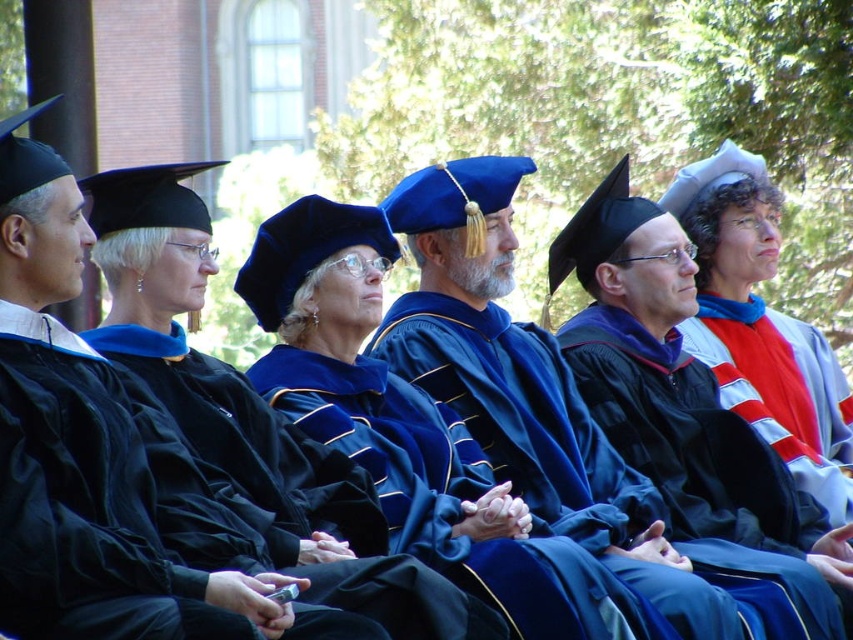
You are a photographer trying to capture a clear shot of the velvet blue graduation gown at center and the velvet blue gown at center. Which one is positioned higher in the image?

The velvet blue graduation gown at center is positioned higher than the velvet blue gown at center in the image.

You are a photographer at the graduation ceremony. You need to capture a photo of the matte black graduation gown at center and the velvet blue gown at center. From the perspective of someone looking at the image, which gown is positioned higher in the frame?

The matte black graduation gown at center is positioned higher in the frame than the velvet blue gown at center.

You are a photographer standing at the back of the graduation ceremony. You want to take a clear photo of the velvet blue graduation gown at center. Considering the distance, is it possible to capture a clear image without using a zoom lens?

The velvet blue graduation gown at center is 59.73 meters away from the camera. Without a zoom lens, capturing a clear image at this distance would be challenging as the subject would appear small and potentially blurry in the frame.